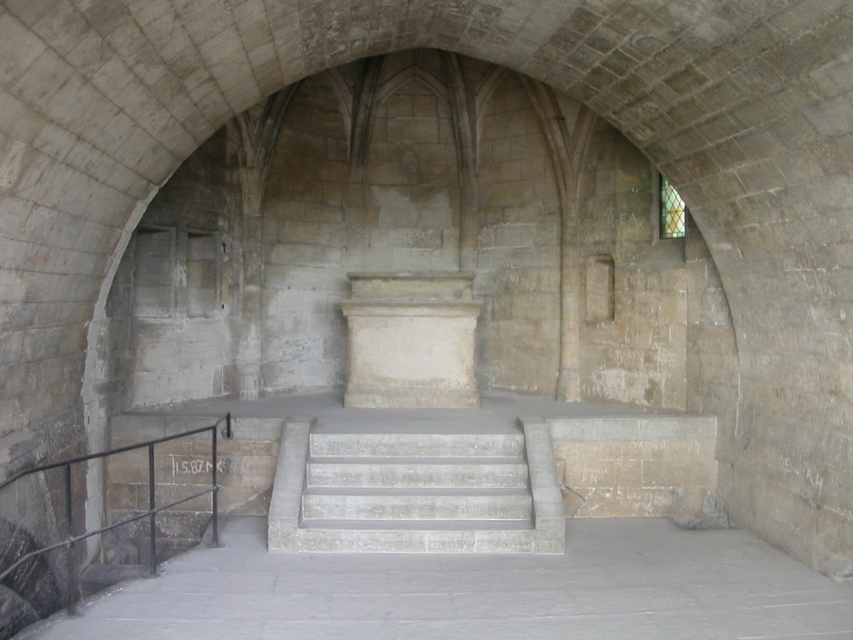
Is white marble stairs at center to the left of black metal/rail at lower left from the viewer's perspective?

In fact, white marble stairs at center is to the right of black metal/rail at lower left.

Looking at this image, who is more forward, (352, 458) or (210, 465)?

Point (352, 458)

Between point (433, 497) and point (9, 570), which one is positioned behind?

Point (433, 497)

The height and width of the screenshot is (640, 853). I want to click on white marble stairs at center, so click(x=415, y=492).

Can you confirm if smooth gray cement at lower center is taller than white stone pedestal at center?

No, smooth gray cement at lower center is not taller than white stone pedestal at center.

Which is in front, point (79, 620) or point (461, 394)?

Point (79, 620) is in front.

The width and height of the screenshot is (853, 640). What are the coordinates of `smooth gray cement at lower center` in the screenshot? It's located at (476, 592).

Does smooth gray cement at lower center have a lesser width compared to black metal/rail at lower left?

In fact, smooth gray cement at lower center might be wider than black metal/rail at lower left.

The height and width of the screenshot is (640, 853). I want to click on smooth gray cement at lower center, so 476,592.

Between point (212, 564) and point (57, 545), which one is positioned behind?

The point (57, 545) is behind.

This screenshot has width=853, height=640. What are the coordinates of `smooth gray cement at lower center` in the screenshot? It's located at (476, 592).